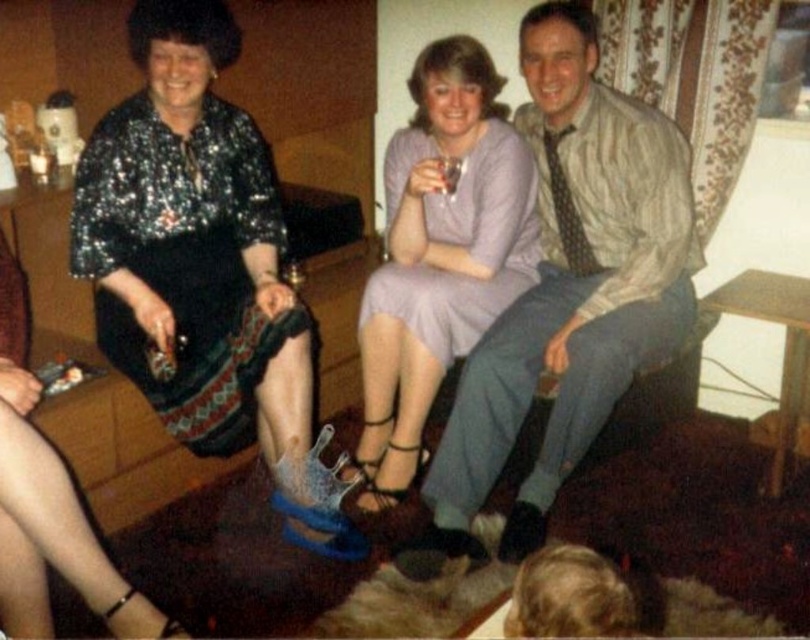
You are standing at the origin of the coordinate system. Which point is closer to you, point [276,234] or point [397,381]?

Point [276,234] is closer to you because it is in front of point [397,381].

You are at a party and see the matte beige shirt at center and the purple satin dress at center. Which one is positioned to the right?

The matte beige shirt at center is positioned to the right of the purple satin dress at center.

What is the object located at coordinates point (x=203, y=268) in the image?

The object located at coordinates point (x=203, y=268) is the shiny sequined dress at upper left.